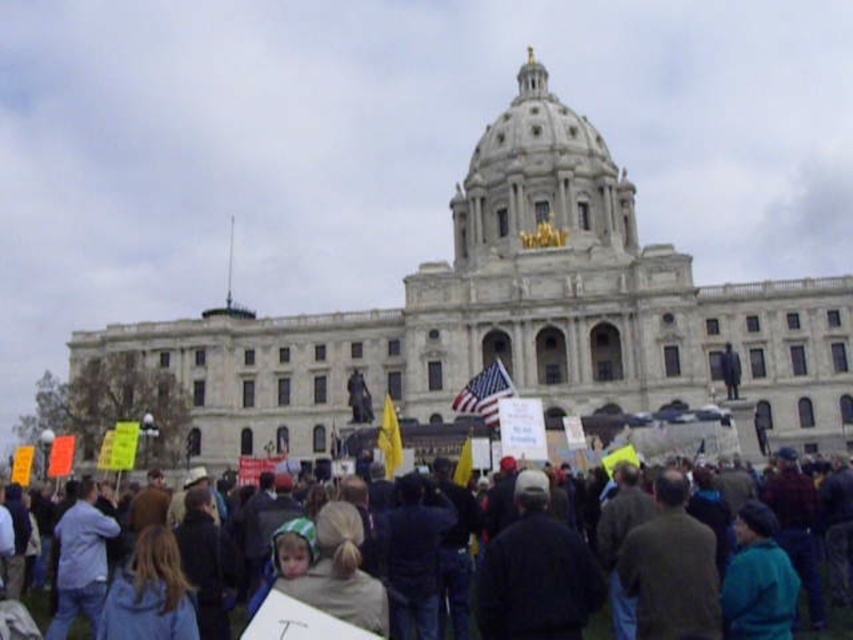
Question: Based on their relative distances, which object is nearer to the american flag at center?

Choices:
 (A) dark blue jackets at center
 (B) yellow fabric flag at center

Answer: (B)

Question: Does dark blue jackets at center have a greater width compared to yellow fabric flag at center?

Choices:
 (A) yes
 (B) no

Answer: (A)

Question: Which of the following is the farthest from the observer?

Choices:
 (A) (492, 410)
 (B) (384, 406)
 (C) (846, 618)

Answer: (B)

Question: Is american flag at center wider than yellow fabric flag at center?

Choices:
 (A) yes
 (B) no

Answer: (A)

Question: Estimate the real-world distances between objects in this image. Which object is farther from the dark blue jackets at center?

Choices:
 (A) yellow fabric flag at center
 (B) american flag at center

Answer: (B)

Question: Does dark blue jackets at center have a larger size compared to yellow fabric flag at center?

Choices:
 (A) no
 (B) yes

Answer: (B)